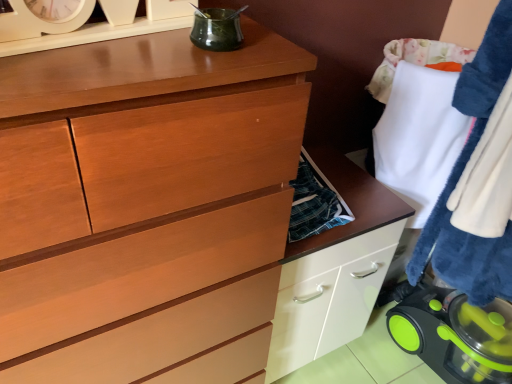
Describe the element at coordinates (461, 173) in the screenshot. This screenshot has height=384, width=512. I see `white fluffy towel at right` at that location.

You are a GUI agent. You are given a task and a screenshot of the screen. Output one action in this format:
    pyautogui.click(x=<x>, y=<y>)
    Task: Click on the green glass jar at upper center, the 2th appliance from the bottom
    This screenshot has width=512, height=384.
    Given the screenshot: What is the action you would take?
    pyautogui.click(x=217, y=30)

Does point (437, 334) come behind point (198, 15)?

Yes.

From the image's perspective, would you say green plastic vacuum cleaner at lower right, which is the 1th appliance from back to front, is positioned over green glass jar at upper center, the second appliance viewed from the back?

No, from the image's perspective, green plastic vacuum cleaner at lower right, which is the 1th appliance from back to front, is not on top of green glass jar at upper center, the second appliance viewed from the back.

Choose the correct answer: Is green plastic vacuum cleaner at lower right, placed as the first appliance when sorted from bottom to top, inside green glass jar at upper center, which is counted as the first appliance, starting from the front, or outside it?

green plastic vacuum cleaner at lower right, placed as the first appliance when sorted from bottom to top, is not inside green glass jar at upper center, which is counted as the first appliance, starting from the front, it's outside.

Identify the location of appliance that is the 2nd one when counting leftward from the white fluffy towel at right. The width and height of the screenshot is (512, 384). (217, 30).

Is green glass jar at upper center, positioned as the 1th appliance in left-to-right order, facing towards white fluffy towel at right?

No, green glass jar at upper center, positioned as the 1th appliance in left-to-right order, is not oriented towards white fluffy towel at right.

Considering the relative positions of green glass jar at upper center, which is counted as the first appliance, starting from the front, and white fluffy towel at right in the image provided, is green glass jar at upper center, which is counted as the first appliance, starting from the front, in front of white fluffy towel at right?

That is True.

Considering the relative sizes of green glass jar at upper center, arranged as the first appliance when viewed from the top, and white fluffy towel at right in the image provided, is green glass jar at upper center, arranged as the first appliance when viewed from the top, smaller than white fluffy towel at right?

Yes.

In the scene shown: Considering the positions of objects green plastic vacuum cleaner at lower right, arranged as the 1th appliance when viewed from the right, and white fluffy towel at right in the image provided, who is more to the left, green plastic vacuum cleaner at lower right, arranged as the 1th appliance when viewed from the right, or white fluffy towel at right?

green plastic vacuum cleaner at lower right, arranged as the 1th appliance when viewed from the right.

Which is nearer, (414, 329) or (458, 266)?

Point (414, 329).

Which of these two, green plastic vacuum cleaner at lower right, which is the second appliance in top-to-bottom order, or white fluffy towel at right, stands shorter?

green plastic vacuum cleaner at lower right, which is the second appliance in top-to-bottom order.

Is white fluffy towel at right thinner than green glass jar at upper center, which appears as the second appliance when viewed from the right?

No.

Is white fluffy towel at right placed right next to green glass jar at upper center, the 2th appliance from the bottom?

white fluffy towel at right and green glass jar at upper center, the 2th appliance from the bottom, are not in contact.

Is white fluffy towel at right further to camera compared to green glass jar at upper center, positioned as the 1th appliance in left-to-right order?

Yes, it is behind green glass jar at upper center, positioned as the 1th appliance in left-to-right order.

How different are the orientations of white fluffy towel at right and green glass jar at upper center, which appears as the second appliance when viewed from the right, in degrees?

The angular difference between white fluffy towel at right and green glass jar at upper center, which appears as the second appliance when viewed from the right, is 92.3 degrees.

From the image's perspective, is white fluffy towel at right located above or below green plastic vacuum cleaner at lower right, which is the 1th appliance from back to front?

white fluffy towel at right is above green plastic vacuum cleaner at lower right, which is the 1th appliance from back to front.

In the scene shown: Is white fluffy towel at right facing towards green plastic vacuum cleaner at lower right, which is the second appliance in top-to-bottom order?

No, white fluffy towel at right is not turned towards green plastic vacuum cleaner at lower right, which is the second appliance in top-to-bottom order.

Considering the sizes of objects white fluffy towel at right and green plastic vacuum cleaner at lower right, which is the 2th appliance from front to back, in the image provided, who is taller, white fluffy towel at right or green plastic vacuum cleaner at lower right, which is the 2th appliance from front to back,?

white fluffy towel at right.

Which of these two, green glass jar at upper center, the second appliance viewed from the back, or green plastic vacuum cleaner at lower right, which is the 1th appliance from back to front, is thinner?

With smaller width is green glass jar at upper center, the second appliance viewed from the back.

Is green glass jar at upper center, arranged as the first appliance when viewed from the top, behind green plastic vacuum cleaner at lower right, which is the 1th appliance from back to front?

No, it is in front of green plastic vacuum cleaner at lower right, which is the 1th appliance from back to front.

Is green glass jar at upper center, which is counted as the first appliance, starting from the front, beside green plastic vacuum cleaner at lower right, acting as the second appliance starting from the left?

green glass jar at upper center, which is counted as the first appliance, starting from the front, is not next to green plastic vacuum cleaner at lower right, acting as the second appliance starting from the left, and they're not touching.

Find the location of a particular element. appliance that appears in front of the green plastic vacuum cleaner at lower right, which is the 1th appliance from back to front is located at coordinates (217, 30).

You are a GUI agent. You are given a task and a screenshot of the screen. Output one action in this format:
    pyautogui.click(x=<x>, y=<y>)
    Task: Click on the appliance on the right of green glass jar at upper center, which is counted as the first appliance, starting from the front
    Image resolution: width=512 pixels, height=384 pixels.
    Given the screenshot: What is the action you would take?
    pyautogui.click(x=444, y=336)

Where is `clothing located underneath the green glass jar at upper center, positioned as the 1th appliance in left-to-right order (from a real-world perspective)`? clothing located underneath the green glass jar at upper center, positioned as the 1th appliance in left-to-right order (from a real-world perspective) is located at coordinates (461, 173).

Estimate the real-world distances between objects in this image. Which object is further from green glass jar at upper center, the second appliance viewed from the back, white fluffy towel at right or green plastic vacuum cleaner at lower right, acting as the second appliance starting from the left?

green plastic vacuum cleaner at lower right, acting as the second appliance starting from the left.

Estimate the real-world distances between objects in this image. Which object is further from white fluffy towel at right, green glass jar at upper center, the second appliance viewed from the back, or green plastic vacuum cleaner at lower right, acting as the second appliance starting from the left?

green glass jar at upper center, the second appliance viewed from the back, lies further to white fluffy towel at right than the other object.

Based on the photo, looking at the image, which one is located further to white fluffy towel at right, green plastic vacuum cleaner at lower right, which is the 2th appliance from front to back, or green glass jar at upper center, which appears as the second appliance when viewed from the right?

green glass jar at upper center, which appears as the second appliance when viewed from the right, lies further to white fluffy towel at right than the other object.

From the image, which object appears to be farther from green plastic vacuum cleaner at lower right, which is the second appliance in top-to-bottom order, green glass jar at upper center, the 2th appliance from the bottom, or white fluffy towel at right?

Based on the image, green glass jar at upper center, the 2th appliance from the bottom, appears to be further to green plastic vacuum cleaner at lower right, which is the second appliance in top-to-bottom order.

Estimate the real-world distances between objects in this image. Which object is further from green plastic vacuum cleaner at lower right, which is the 1th appliance from back to front, white fluffy towel at right or green glass jar at upper center, the second appliance viewed from the back?

green glass jar at upper center, the second appliance viewed from the back, is further to green plastic vacuum cleaner at lower right, which is the 1th appliance from back to front.

From the image, which object appears to be farther from green glass jar at upper center, positioned as the 1th appliance in left-to-right order, green plastic vacuum cleaner at lower right, which is the 1th appliance from back to front, or white fluffy towel at right?

green plastic vacuum cleaner at lower right, which is the 1th appliance from back to front.

The height and width of the screenshot is (384, 512). Find the location of `appliance between green glass jar at upper center, which is counted as the first appliance, starting from the front, and white fluffy towel at right from left to right`. appliance between green glass jar at upper center, which is counted as the first appliance, starting from the front, and white fluffy towel at right from left to right is located at coordinates (444, 336).